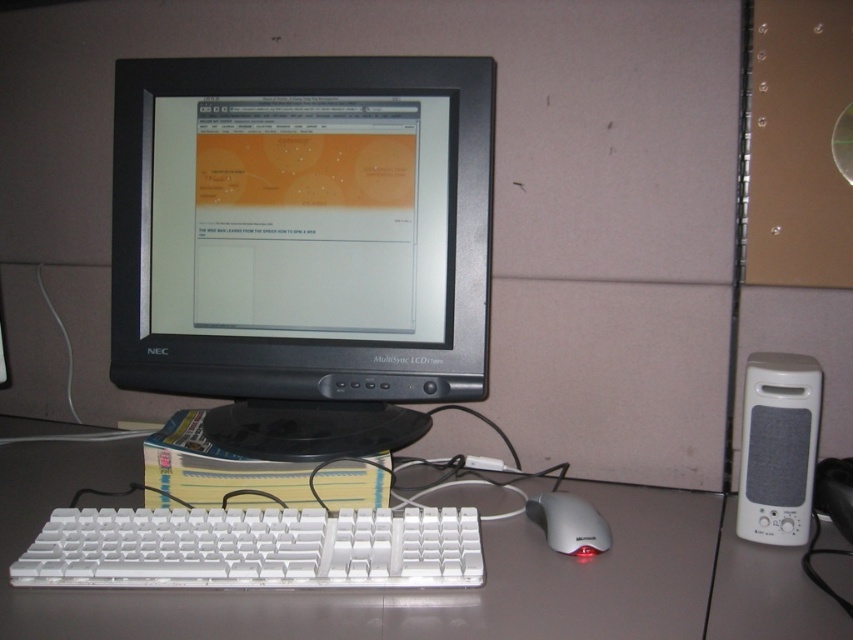
Can you confirm if black plastic monitor at center is positioned to the right of white plastic mouse at lower center?

In fact, black plastic monitor at center is to the left of white plastic mouse at lower center.

Is black plastic monitor at center smaller than white plastic mouse at lower center?

No.

The image size is (853, 640). In order to click on black plastic monitor at center in this screenshot , I will do 303,243.

Which is behind, point (155, 621) or point (529, 515)?

Point (529, 515)

In the scene shown: Who is positioned more to the left, white plastic keyboard at center or white plastic mouse at lower center?

From the viewer's perspective, white plastic keyboard at center appears more on the left side.

Does point (554, 604) come behind point (538, 518)?

No, (554, 604) is in front of (538, 518).

Locate an element on the screen. The height and width of the screenshot is (640, 853). white plastic keyboard at center is located at coordinates (381, 589).

Can you confirm if white plastic keyboard at lower center is wider than white plastic speaker at right?

Yes.

Does white plastic keyboard at lower center appear on the right side of white plastic speaker at right?

In fact, white plastic keyboard at lower center is to the left of white plastic speaker at right.

Does point (268, 566) come behind point (752, 364)?

No, it is not.

Locate an element on the screen. white plastic keyboard at lower center is located at coordinates (254, 548).